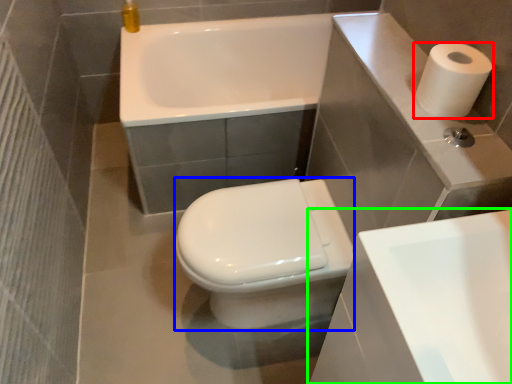
Question: Based on their relative distances, which object is farther from paper towel (highlighted by a red box)? Choose from bidet (highlighted by a blue box) and sink (highlighted by a green box).

Choices:
 (A) bidet
 (B) sink

Answer: (A)